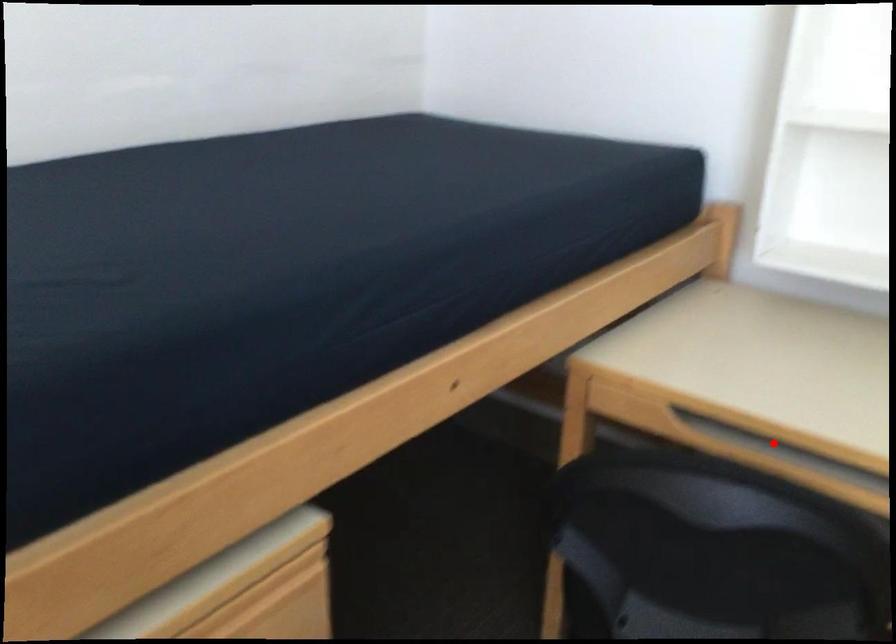
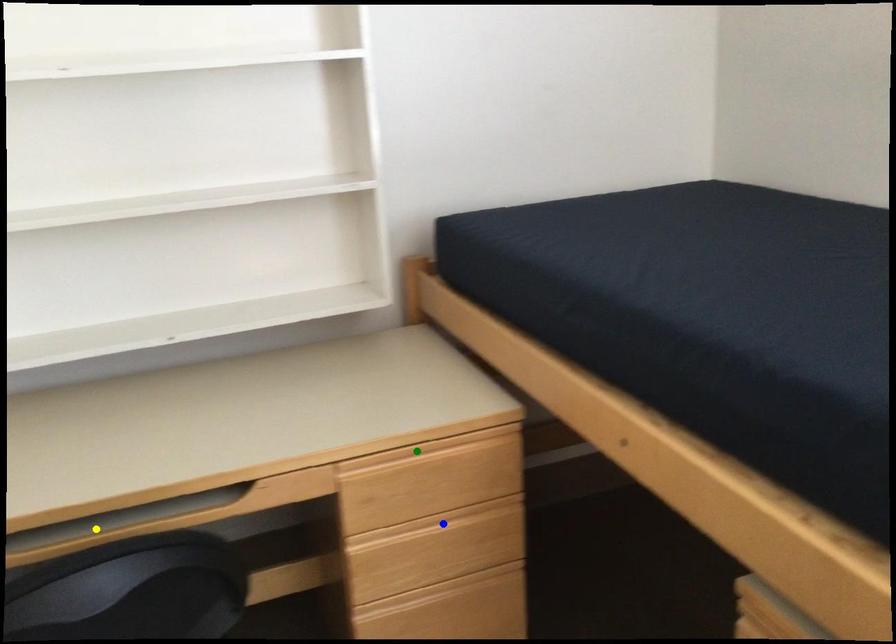
Question: I am providing you with two images of the same scene from different viewpoints. A red point is marked on the first image. You are given multiple points on the second image. In image 2, which mark is for the same physical point as the one in image 1?

Choices:
 (A) green point
 (B) blue point
 (C) yellow point

Answer: (C)